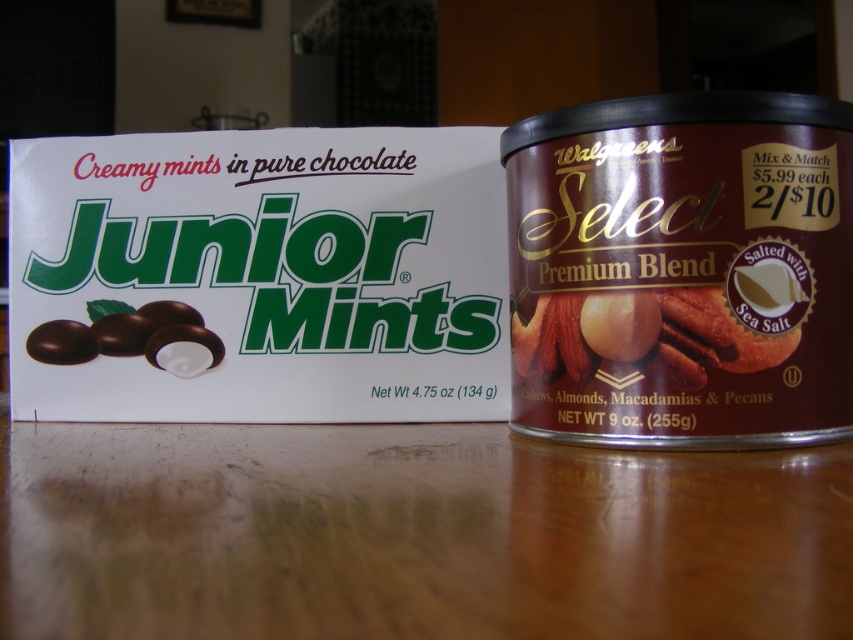
You are a customer at a store looking at two products on a table. You see the chocolate matte junior mints at left and the matte chocolate mints at left. Which one is closer to you?

The chocolate matte junior mints at left is closer to you since it is in front of the matte chocolate mints at left.

You are a delivery person who just received a box that needs to be stored in a cabinet with limited vertical space. You see the brown glossy nuts at center and the chocolate matte junior mints at left. Which item should you choose to store vertically to save space?

The chocolate matte junior mints at left should be stored vertically to save space because it is shorter than the brown glossy nuts at center, which is much taller.

What are the coordinates of the brown glossy nuts at center?

The brown glossy nuts at center are located at coordinates point (641, 333).